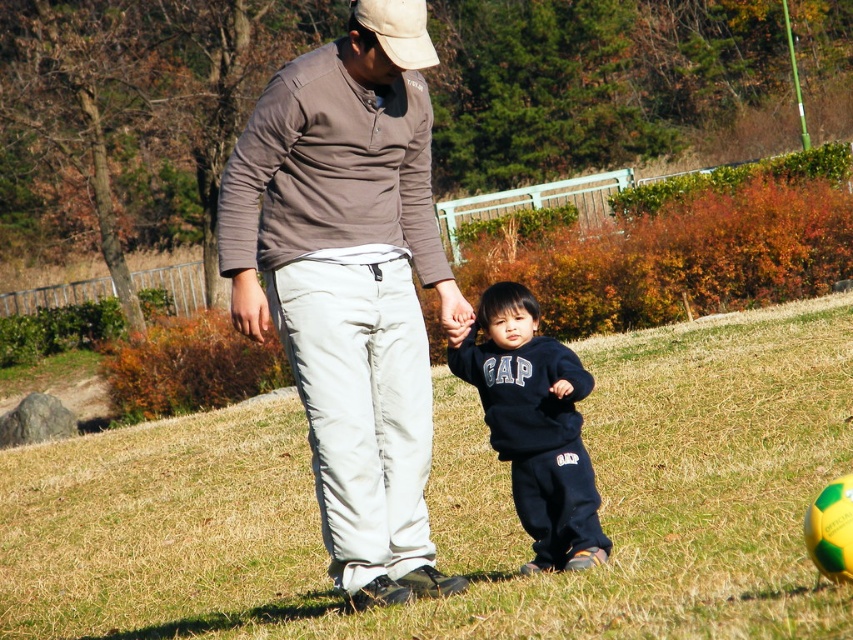
You are trying to determine which object is wider between the black fleece sweatshirt at center and the white fabric baseball cap at upper center. Based on the scene description, which one has a greater width?

The black fleece sweatshirt at center has a greater width than the white fabric baseball cap at upper center.

You are a drone operator trying to capture a photo of the green grass at center and the matte brown shirt at center. Which object should you focus on first if you want to ensure both are in focus without adjusting the camera settings?

The matte brown shirt at center is closer to the camera than the green grass at center, so focus on the matte brown shirt at center first to ensure both are in focus.

You are standing at the point labeled point (630, 588) and want to walk to the point labeled point (254, 180). Based on the scene description, which direction should you move to get closer to your destination?

You should move away from the viewer because point (254, 180) is further away than point (630, 588).